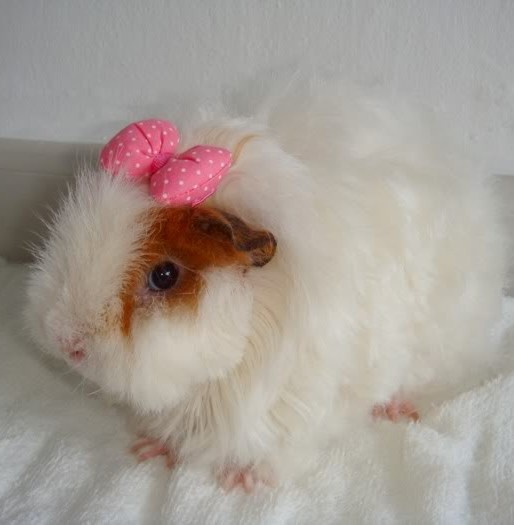
Identify the location of tan baseboard. (28, 177).